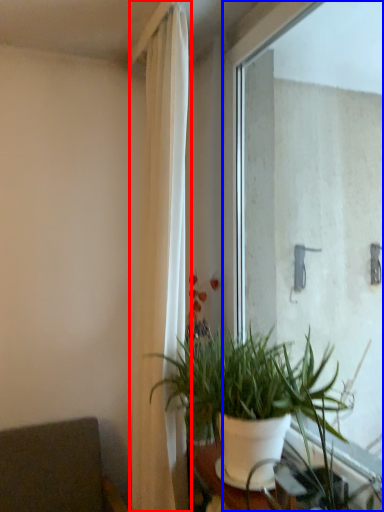
Question: Which object appears farthest to the camera in this image, curtain (highlighted by a red box) or window (highlighted by a blue box)?

Choices:
 (A) curtain
 (B) window

Answer: (A)